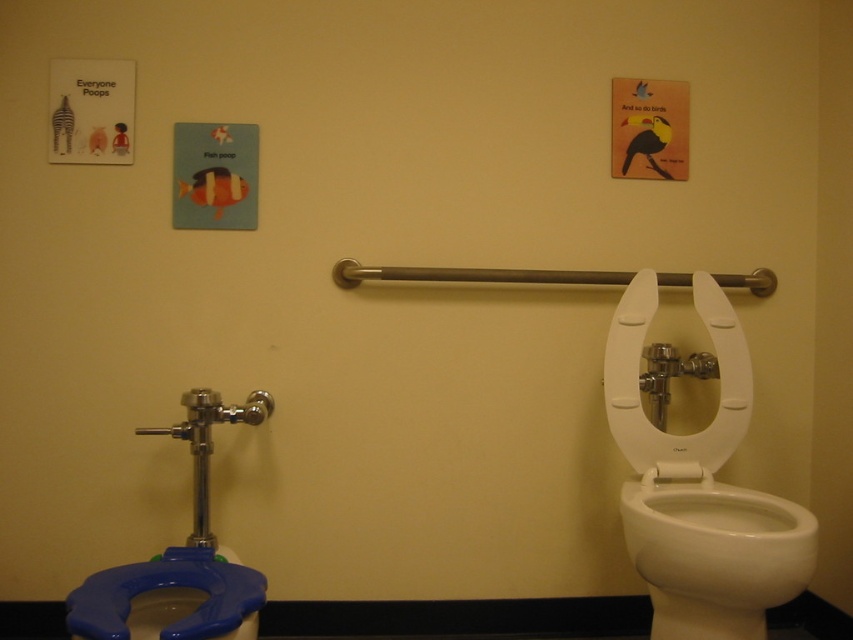
Question: Is white glossy toilet bowl at right behind white matte toilet paper at upper center?

Choices:
 (A) no
 (B) yes

Answer: (A)

Question: Among these points, which one is nearest to the camera?

Choices:
 (A) (67, 620)
 (B) (236, 560)

Answer: (A)

Question: Does white glossy toilet bowl at right appear under blue plastic toilet paper at lower left?

Choices:
 (A) no
 (B) yes

Answer: (A)

Question: Which object is farther from the camera taking this photo?

Choices:
 (A) blue plastic toilet seat at lower left
 (B) white matte toilet paper at upper center
 (C) blue plastic toilet paper at lower left

Answer: (B)

Question: Which object is positioned closest to the white glossy toilet bowl at right?

Choices:
 (A) white matte toilet paper at upper center
 (B) blue plastic toilet seat at lower left
 (C) blue plastic toilet paper at lower left

Answer: (A)

Question: Observing the image, what is the correct spatial positioning of white plastic toilet seat at right in reference to blue plastic toilet seat at lower left?

Choices:
 (A) right
 (B) left

Answer: (A)